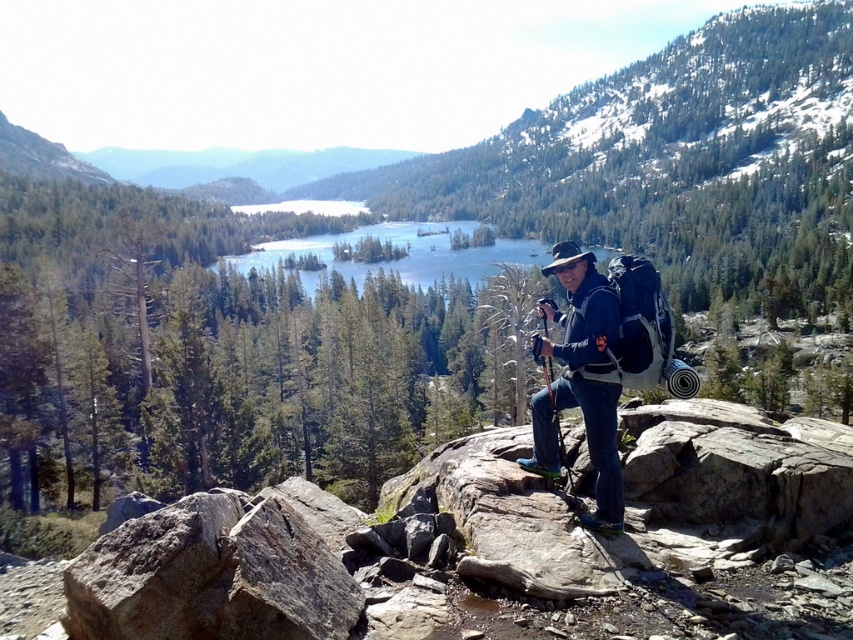
Based on the photo, you are a hiker who wants to refill your water bottle. You see clear blue water at center. Is the water at the center of the image accessible for you to reach?

The clear blue water at center is located at point (405, 252), so yes, it is accessible for you to reach.

You are a hiker trying to navigate through the rocky terrain. You see the clear blue water at center and the wooden cane at center. Which object is located to the right side of the other?

The wooden cane at center is located to the right of the clear blue water at center.

You are a hiker trying to decide whether to wear your matte blue jacket at center over your wooden cane at center while hiking. Based on their sizes, which one should you carry in your backpack to save space?

The wooden cane at center is narrower than the matte blue jacket at center, so you should carry the matte blue jacket at center in your backpack to save space.